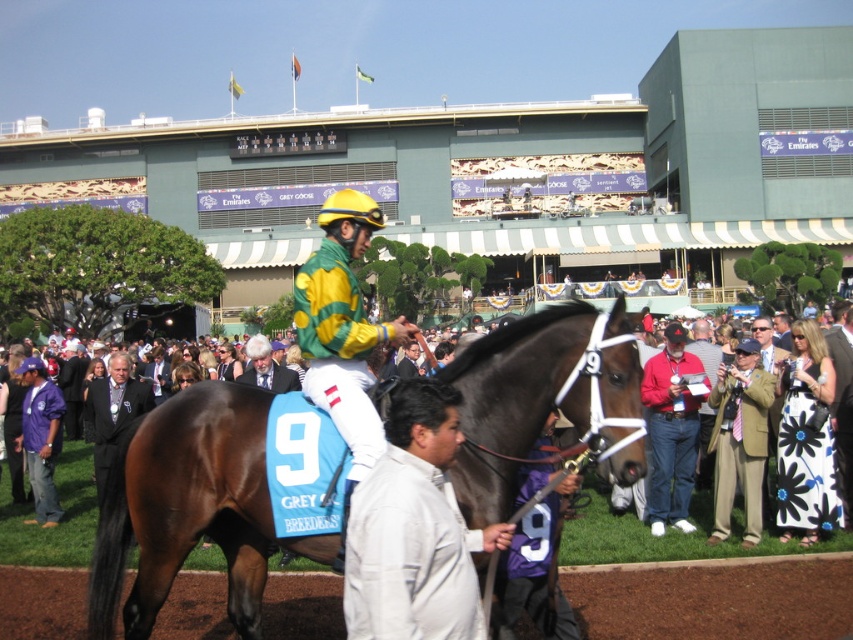
You are a photographer standing at the starting line of the horse race. You want to capture a photo of the khaki fabric suit at center. Based on the coordinates provided, where should you position your camera relative to the scene?

The khaki fabric suit at center is located at coordinates point [740,440], so you should position your camera to focus on that point to capture the khaki fabric suit at center.

You are a photographer standing at the edge of the horse racing track. You want to take a photo of the brown glossy horse at center and the red cotton shirt at center. Based on their sizes, which object should you focus on first to ensure both are in frame?

The brown glossy horse at center is taller than the red cotton shirt at center, so you should focus on the brown glossy horse at center first to ensure both are in frame.